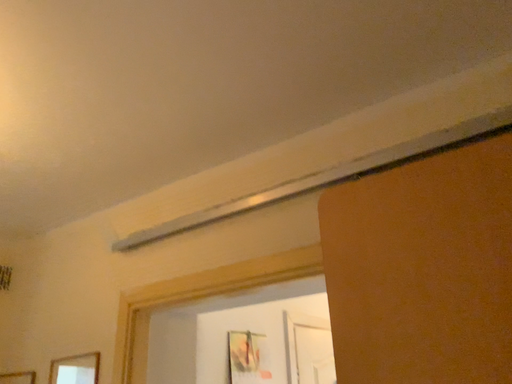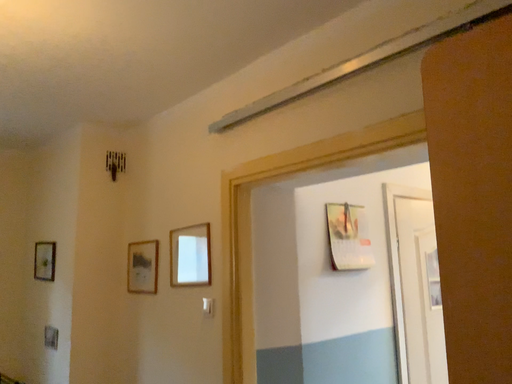
Question: Which way did the camera rotate in the video?

Choices:
 (A) rotated upward
 (B) rotated downward

Answer: (B)